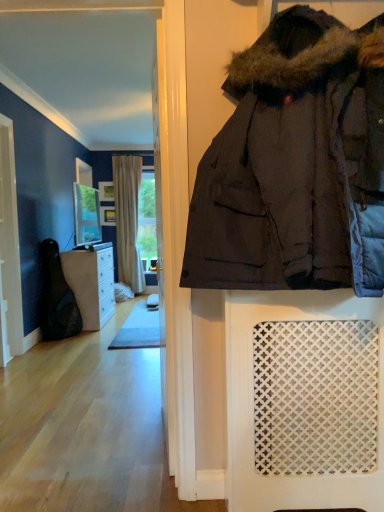
Question: Based on their sizes in the image, would you say matte glass mirror at upper center is bigger or smaller than wooden frame at center, which appears as the second picture frame when viewed from the top?

Choices:
 (A) small
 (B) big

Answer: (B)

Question: Considering the relative positions of matte glass mirror at upper center and wooden frame at center, arranged as the 1th picture frame when ordered from the bottom, in the image provided, is matte glass mirror at upper center to the left or to the right of wooden frame at center, arranged as the 1th picture frame when ordered from the bottom,?

Choices:
 (A) left
 (B) right

Answer: (B)

Question: Which of these objects is positioned closest to the white wood screen door at left?

Choices:
 (A) white lattice mat at lower right
 (B) brown wood cabinet at left
 (C) wooden frame at center, which appears as the second picture frame when viewed from the top
 (D) matte glass mirror at upper center
 (E) wooden frame at center, marked as the 1th picture frame in a top-to-bottom arrangement

Answer: (B)

Question: Which of these objects is positioned farthest from the wooden frame at center, arranged as the 1th picture frame when ordered from the bottom?

Choices:
 (A) wooden frame at center, marked as the 1th picture frame in a top-to-bottom arrangement
 (B) beige textured curtain at center
 (C) dark brown puffy jacket at center
 (D) white lattice mat at lower right
 (E) matte glass mirror at upper center

Answer: (C)